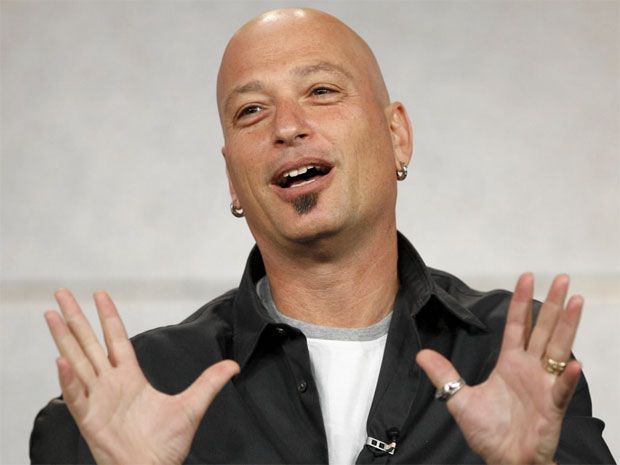
Where is `blurry white wall`? blurry white wall is located at coordinates (450, 194).